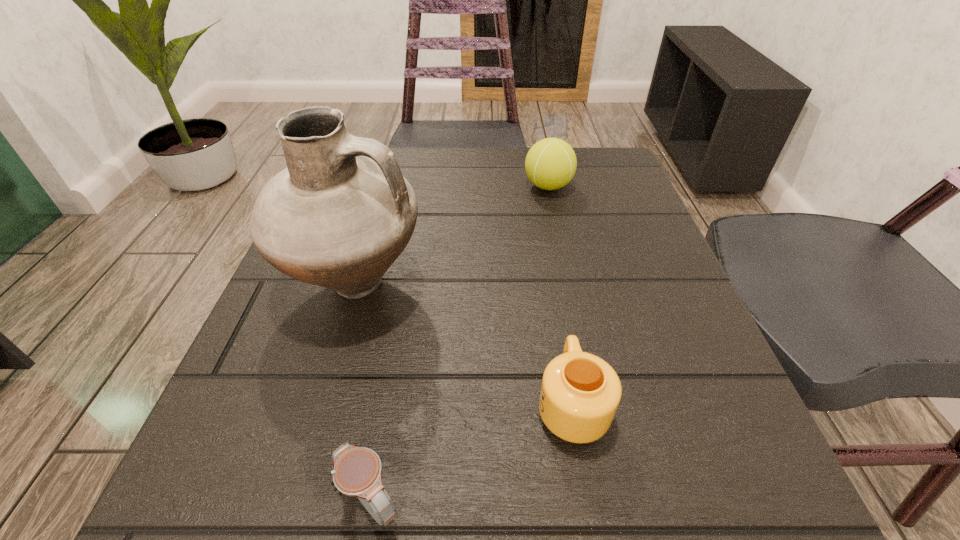
Locate an element on the screen. free point between the tennis ball and the tallest object is located at coordinates (452, 236).

I want to click on free point between the second farthest object and the tennis ball, so click(452, 236).

Locate an element on the screen. This screenshot has width=960, height=540. free space between the nearest object and the third farthest object is located at coordinates (471, 453).

Identify which object is the closest to the watch. Please provide its 2D coordinates. Your answer should be formatted as a tuple, i.e. [(x, y)], where the tuple contains the x and y coordinates of a point satisfying the conditions above.

[(580, 393)]

Select which object appears as the second closest to the mug. Please provide its 2D coordinates. Your answer should be formatted as a tuple, i.e. [(x, y)], where the tuple contains the x and y coordinates of a point satisfying the conditions above.

[(338, 216)]

The height and width of the screenshot is (540, 960). Identify the location of free space that satisfies the following two spatial constraints: 1. on the handle side of the watch; 2. on the right side of the pitcher. (292, 502).

Locate an element on the screen. The height and width of the screenshot is (540, 960). vacant region that satisfies the following two spatial constraints: 1. on the handle side of the mug; 2. on the handle side of the tallest object is located at coordinates (551, 286).

You are a GUI agent. You are given a task and a screenshot of the screen. Output one action in this format:
    pyautogui.click(x=<x>, y=<y>)
    Task: Click on the vacant position in the image that satisfies the following two spatial constraints: 1. on the back side of the watch; 2. on the right side of the tennis ball
    
    Given the screenshot: What is the action you would take?
    pyautogui.click(x=425, y=186)

You are a GUI agent. You are given a task and a screenshot of the screen. Output one action in this format:
    pyautogui.click(x=<x>, y=<y>)
    Task: Click on the free space in the image that satisfies the following two spatial constraints: 1. on the handle side of the tallest object; 2. on the back side of the nearest object
    
    Given the screenshot: What is the action you would take?
    pyautogui.click(x=292, y=502)

Find the location of a particular element. The width and height of the screenshot is (960, 540). vacant position in the image that satisfies the following two spatial constraints: 1. on the handle side of the second nearest object; 2. on the handle side of the third nearest object is located at coordinates (551, 286).